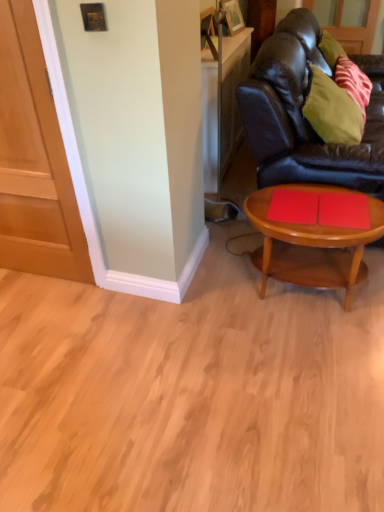
Question: Is matte wood door at left oriented away from green fabric pillow at upper right?

Choices:
 (A) yes
 (B) no

Answer: (B)

Question: Can you confirm if matte wood door at left is thinner than green fabric pillow at upper right?

Choices:
 (A) yes
 (B) no

Answer: (A)

Question: From the image's perspective, is matte wood door at left on top of green fabric pillow at upper right?

Choices:
 (A) no
 (B) yes

Answer: (A)

Question: Is green fabric pillow at upper right surrounded by matte wood door at left?

Choices:
 (A) yes
 (B) no

Answer: (B)

Question: From the image's perspective, is matte wood door at left located beneath green fabric pillow at upper right?

Choices:
 (A) no
 (B) yes

Answer: (B)

Question: Is point (337, 98) positioned closer to the camera than point (256, 224)?

Choices:
 (A) closer
 (B) farther

Answer: (B)

Question: From a real-world perspective, is green fabric pillow at upper right positioned above or below wooden coffee table at lower right?

Choices:
 (A) above
 (B) below

Answer: (A)

Question: Is green fabric pillow at upper right in front of or behind wooden coffee table at lower right in the image?

Choices:
 (A) behind
 (B) front

Answer: (A)

Question: Based on their sizes in the image, would you say green fabric pillow at upper right is bigger or smaller than wooden coffee table at lower right?

Choices:
 (A) big
 (B) small

Answer: (B)

Question: Considering the relative positions of matte wood door at left and green fabric pillow at upper right in the image provided, is matte wood door at left to the left or to the right of green fabric pillow at upper right?

Choices:
 (A) left
 (B) right

Answer: (A)

Question: In terms of height, does matte wood door at left look taller or shorter compared to green fabric pillow at upper right?

Choices:
 (A) tall
 (B) short

Answer: (A)

Question: Relative to green fabric pillow at upper right, is matte wood door at left in front or behind?

Choices:
 (A) front
 (B) behind

Answer: (A)

Question: Is matte wood door at left situated inside green fabric pillow at upper right or outside?

Choices:
 (A) inside
 (B) outside

Answer: (B)

Question: Considering the relative positions of black leather couch at right and green fabric pillow at upper right in the image provided, is black leather couch at right to the left or to the right of green fabric pillow at upper right?

Choices:
 (A) left
 (B) right

Answer: (B)

Question: In the image, is black leather couch at right positioned in front of or behind green fabric pillow at upper right?

Choices:
 (A) front
 (B) behind

Answer: (A)